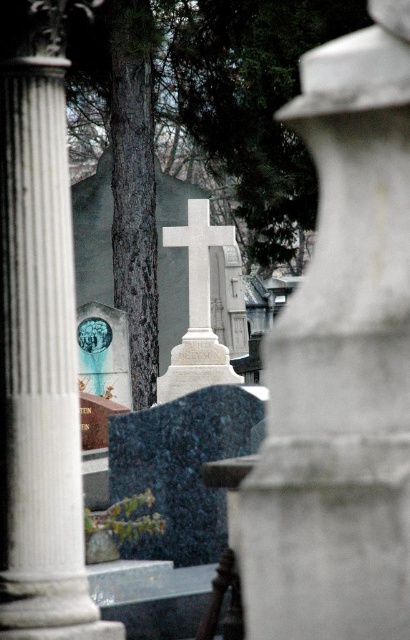
Which of these two, white marble pillar at center or white marble column at left, stands taller?

With more height is white marble pillar at center.

The height and width of the screenshot is (640, 410). What do you see at coordinates (341, 364) in the screenshot?
I see `white marble pillar at center` at bounding box center [341, 364].

The height and width of the screenshot is (640, 410). What are the coordinates of `white marble pillar at center` in the screenshot? It's located at (341, 364).

The width and height of the screenshot is (410, 640). In order to click on white marble pillar at center in this screenshot , I will do `click(341, 364)`.

Does white marble column at left appear over white marble cross at center?

Actually, white marble column at left is below white marble cross at center.

Between point (9, 275) and point (198, 307), which one is positioned behind?

Positioned behind is point (198, 307).

Where is `white marble column at left`? This screenshot has width=410, height=640. white marble column at left is located at coordinates (38, 339).

Is white marble pillar at center thinner than white marble cross at center?

No.

Locate an element on the screen. Image resolution: width=410 pixels, height=640 pixels. white marble pillar at center is located at coordinates (341, 364).

Between point (375, 243) and point (202, 292), which one is positioned in front?

Point (375, 243) is in front.

I want to click on white marble pillar at center, so click(x=341, y=364).